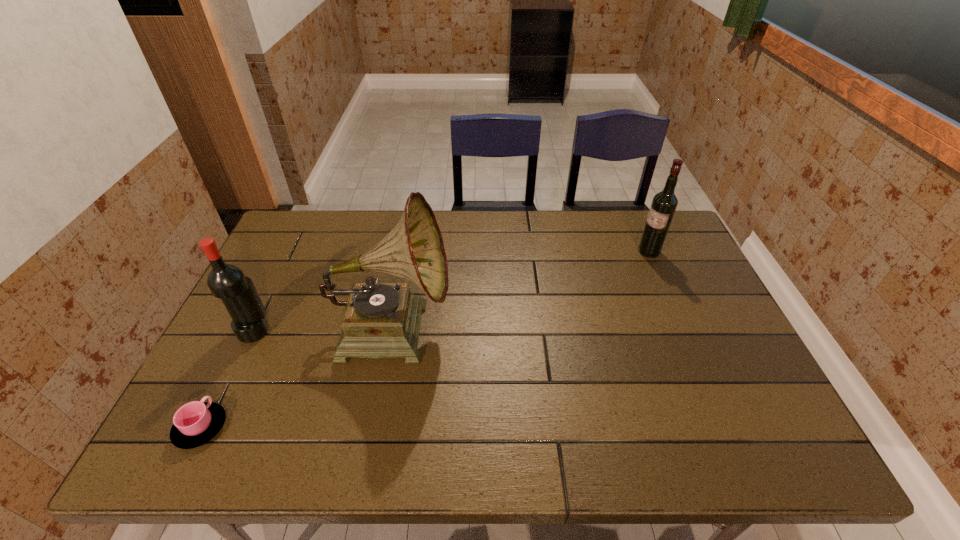
Where is `free spot that satisfies the following two spatial constraints: 1. on the front and back of the right wine bottle; 2. on the front side of the nearer wine bottle`? The width and height of the screenshot is (960, 540). free spot that satisfies the following two spatial constraints: 1. on the front and back of the right wine bottle; 2. on the front side of the nearer wine bottle is located at coordinates (684, 330).